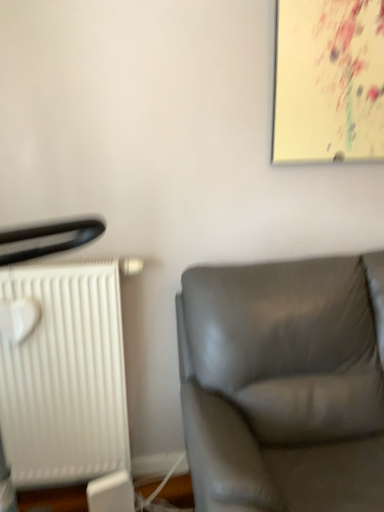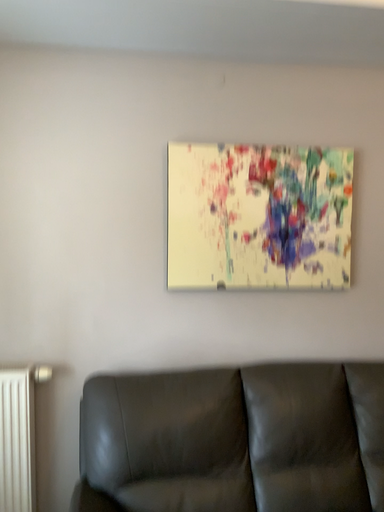
Question: How did the camera likely rotate when shooting the video?

Choices:
 (A) rotated upward
 (B) rotated downward

Answer: (A)